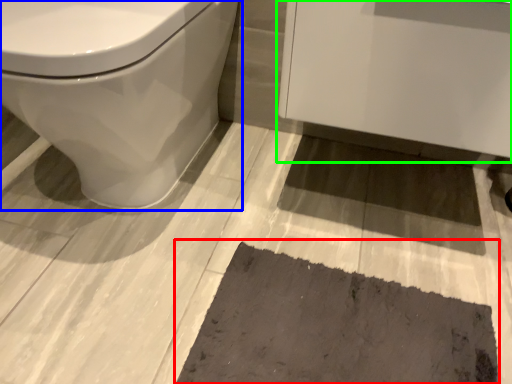
Question: Considering the real-world distances, which object is closest to bath mat (highlighted by a red box)? toilet (highlighted by a blue box) or porcelain (highlighted by a green box).

Choices:
 (A) toilet
 (B) porcelain

Answer: (B)